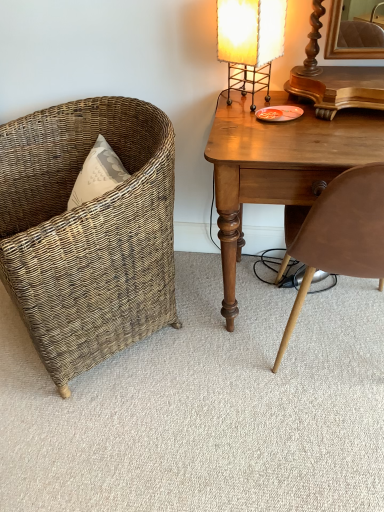
Where is `free point in front of woven brown chair at left, which is counted as the first chair, starting from the left`? The width and height of the screenshot is (384, 512). free point in front of woven brown chair at left, which is counted as the first chair, starting from the left is located at coordinates (129, 430).